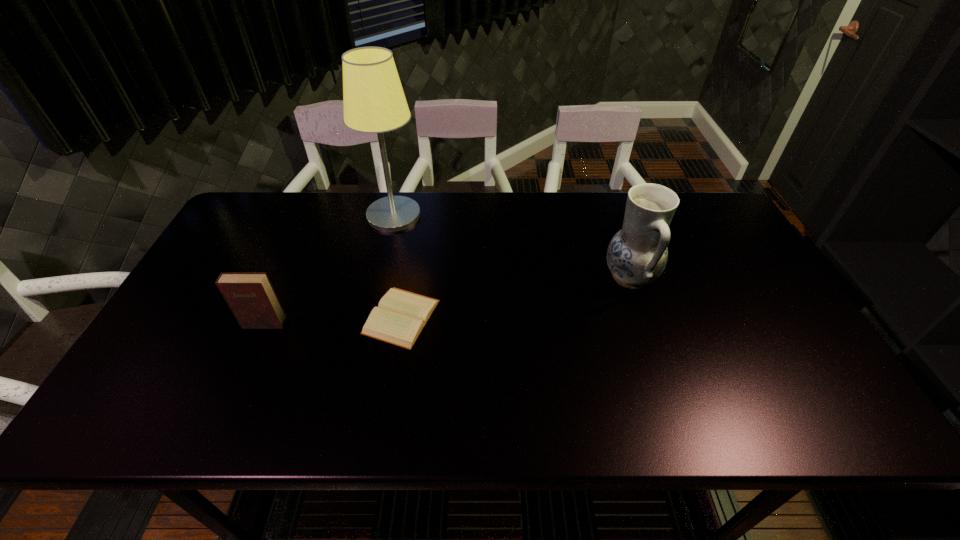
Find the location of a particular element. The width and height of the screenshot is (960, 540). free space between the second tallest object and the shorter diary is located at coordinates (516, 297).

This screenshot has height=540, width=960. Identify the location of vacant area between the third shortest object and the table lamp. point(512,246).

This screenshot has width=960, height=540. What are the coordinates of `vacant area that lies between the rightmost object and the leftmost object` in the screenshot? It's located at (447, 300).

The width and height of the screenshot is (960, 540). What are the coordinates of `vacant space in between the pottery and the shorter diary` in the screenshot? It's located at click(x=516, y=297).

Image resolution: width=960 pixels, height=540 pixels. In order to click on vacant space that is in between the leftmost object and the shortest object in this screenshot , I will do `click(333, 320)`.

This screenshot has height=540, width=960. In order to click on vacant region between the shortest object and the pottery in this screenshot , I will do `click(516, 297)`.

Image resolution: width=960 pixels, height=540 pixels. I want to click on free point between the farthest object and the third tallest object, so click(329, 269).

This screenshot has height=540, width=960. In order to click on free space between the left diary and the third shortest object in this screenshot , I will do `click(447, 300)`.

You are a GUI agent. You are given a task and a screenshot of the screen. Output one action in this format:
    pyautogui.click(x=<x>, y=<y>)
    Task: Click on the free space that is in between the leftmost object and the tallest object
    
    Given the screenshot: What is the action you would take?
    (x=329, y=269)

Locate an element on the screen. blank region between the third shortest object and the table lamp is located at coordinates (512, 246).